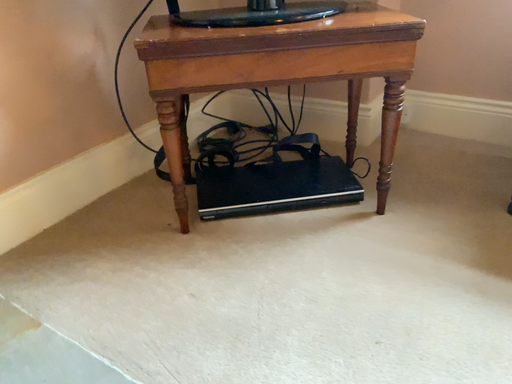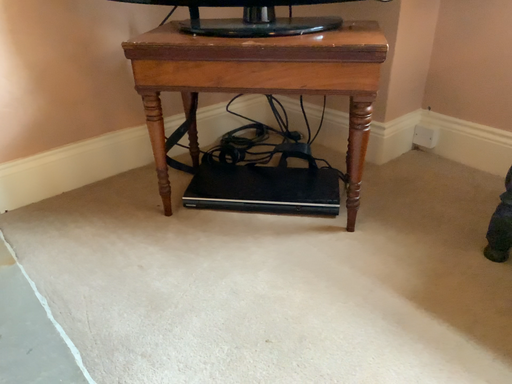
Question: How did the camera likely rotate when shooting the video?

Choices:
 (A) rotated left
 (B) rotated right

Answer: (A)